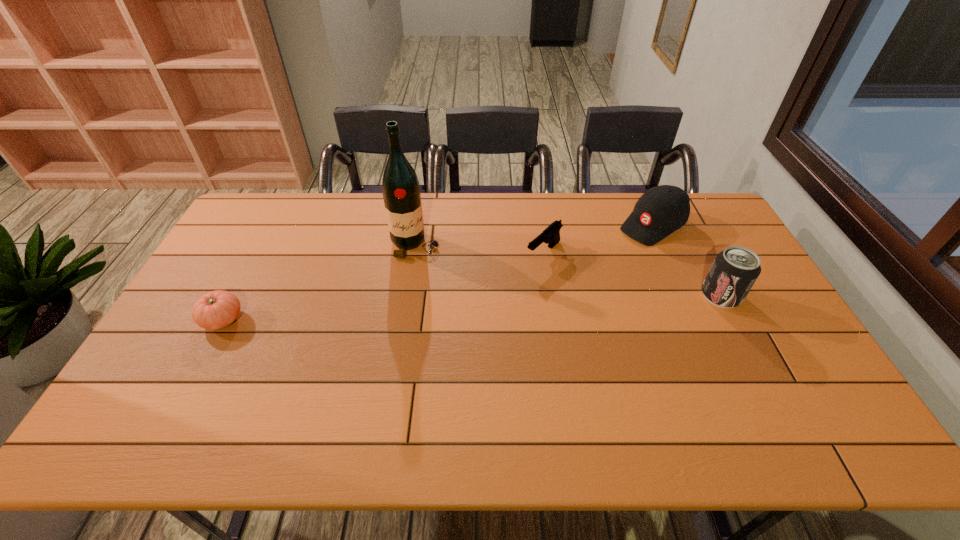
At what (x,y) coordinates should I click in order to perform the action: click on soda can that is at the right edge. Please return your answer as a coordinate pair (x, y). Looking at the image, I should click on (734, 271).

Find the location of a particular element. Image resolution: width=960 pixels, height=540 pixels. baseball cap that is at the right edge is located at coordinates (661, 210).

Where is `object positioned at the far right corner`? The height and width of the screenshot is (540, 960). object positioned at the far right corner is located at coordinates (661, 210).

In the image, there is a desktop. What are the coordinates of `vacant space at the far edge` in the screenshot? It's located at (609, 197).

Image resolution: width=960 pixels, height=540 pixels. In the image, there is a desktop. What are the coordinates of `vacant space at the near edge` in the screenshot? It's located at (444, 375).

At what (x,y) coordinates should I click in order to perform the action: click on vacant space at the left edge of the desktop. Please return your answer as a coordinate pair (x, y). The height and width of the screenshot is (540, 960). Looking at the image, I should click on (231, 248).

The height and width of the screenshot is (540, 960). Identify the location of vacant space that's between the tomato and the wine bottle. (319, 282).

This screenshot has height=540, width=960. I want to click on free area in between the tallest object and the tomato, so click(x=319, y=282).

The height and width of the screenshot is (540, 960). What are the coordinates of `free spot between the leftmost object and the baseball cap` in the screenshot? It's located at (438, 273).

The height and width of the screenshot is (540, 960). Find the location of `free spot between the third shortest object and the soda can`. free spot between the third shortest object and the soda can is located at coordinates [x=686, y=261].